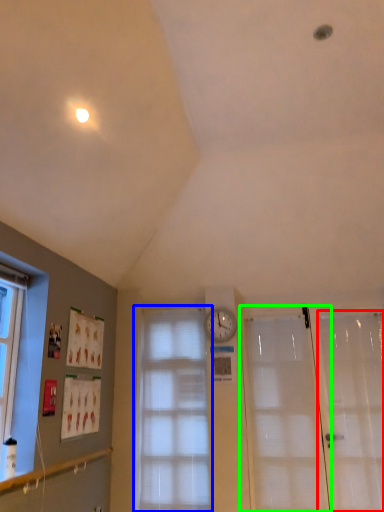
Question: Which object is positioned closest to screen door (highlighted by a red box)? Select from window (highlighted by a blue box) and door (highlighted by a green box).

Choices:
 (A) window
 (B) door

Answer: (B)